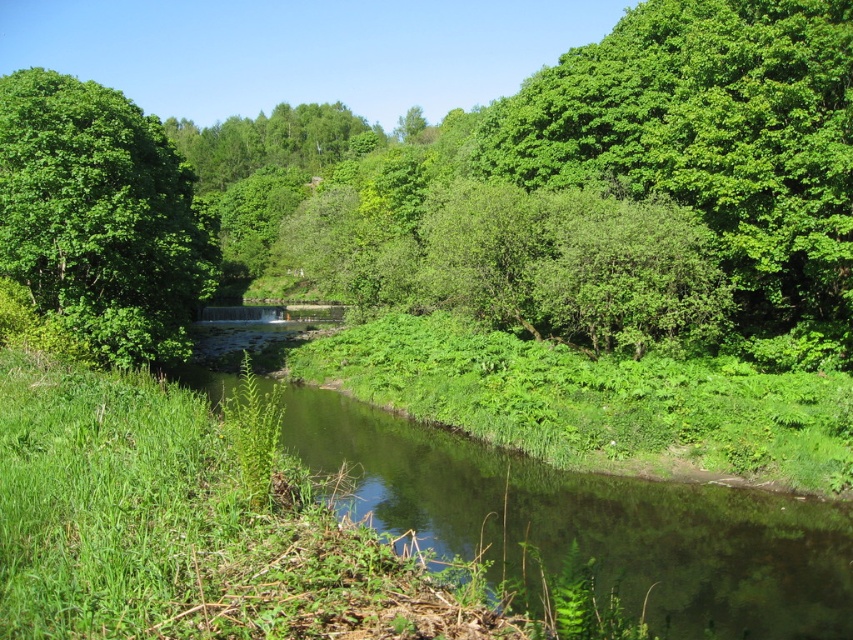
Which of these two, clear water at center or green leafy tree at upper left, stands taller?

green leafy tree at upper left

Who is more distant from viewer, (534, 508) or (73, 88)?

The point (73, 88) is behind.

Locate an element on the screen. The image size is (853, 640). clear water at center is located at coordinates (595, 524).

Find the location of a particular element. clear water at center is located at coordinates (595, 524).